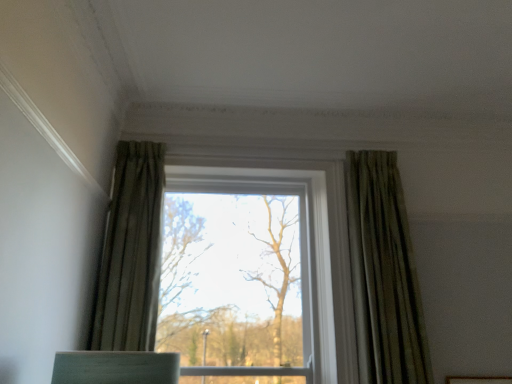
Question: From the image's perspective, would you say green textured curtain at left, which is the second curtain from right to left, is positioned over clear glass window at center?

Choices:
 (A) no
 (B) yes

Answer: (B)

Question: From a real-world perspective, is green textured curtain at left, which is the second curtain from right to left, physically below clear glass window at center?

Choices:
 (A) yes
 (B) no

Answer: (B)

Question: Is green textured curtain at left, the 1th curtain from the left, smaller than clear glass window at center?

Choices:
 (A) no
 (B) yes

Answer: (B)

Question: Is green textured curtain at left, which is the second curtain from right to left, looking in the opposite direction of clear glass window at center?

Choices:
 (A) no
 (B) yes

Answer: (B)

Question: Is green textured curtain at left, which is the second curtain from right to left, to the left of clear glass window at center from the viewer's perspective?

Choices:
 (A) yes
 (B) no

Answer: (A)

Question: Is green textured curtain at left, the 1th curtain from the left, positioned before clear glass window at center?

Choices:
 (A) no
 (B) yes

Answer: (B)

Question: Is clear glass window at center thinner than green textured curtain at right, which ranks as the 1th curtain in right-to-left order?

Choices:
 (A) yes
 (B) no

Answer: (B)

Question: Is clear glass window at center bigger than green textured curtain at right, which ranks as the 1th curtain in right-to-left order?

Choices:
 (A) yes
 (B) no

Answer: (A)

Question: Does clear glass window at center have a lesser height compared to green textured curtain at right, which ranks as the 1th curtain in right-to-left order?

Choices:
 (A) no
 (B) yes

Answer: (B)

Question: From a real-world perspective, does clear glass window at center sit lower than green textured curtain at right, which ranks as the 1th curtain in right-to-left order?

Choices:
 (A) no
 (B) yes

Answer: (B)

Question: Is clear glass window at center positioned with its back to green textured curtain at right, which is the second curtain in left-to-right order?

Choices:
 (A) no
 (B) yes

Answer: (A)

Question: From the image's perspective, is clear glass window at center beneath green textured curtain at right, which is the second curtain in left-to-right order?

Choices:
 (A) yes
 (B) no

Answer: (A)

Question: From a real-world perspective, does green textured curtain at left, the 1th curtain from the left, stand above green textured curtain at right, which ranks as the 1th curtain in right-to-left order?

Choices:
 (A) yes
 (B) no

Answer: (A)